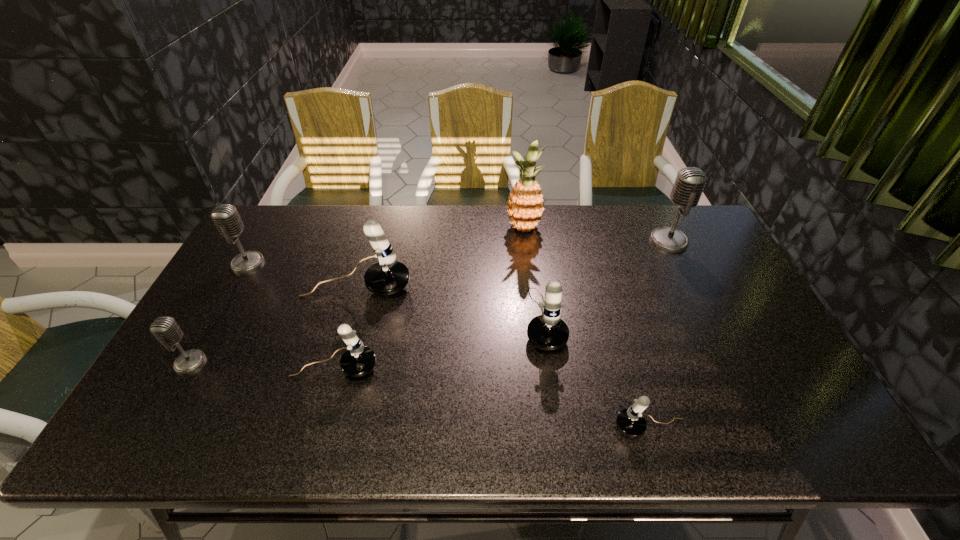
In order to click on the tallest object in this screenshot , I will do `click(525, 207)`.

The width and height of the screenshot is (960, 540). Find the location of `the rightmost microphone`. the rightmost microphone is located at coordinates pos(690,182).

Find the location of a particular element. the farthest microphone is located at coordinates (690, 182).

At what (x,y) coordinates should I click in order to perform the action: click on the biggest white microphone. Please return your answer as a coordinate pair (x, y). The height and width of the screenshot is (540, 960). Looking at the image, I should click on (386, 277).

Identify the location of the second nearest gray microphone. coord(225,216).

Find the location of a particular element. The image size is (960, 540). the fifth microphone from left to right is located at coordinates (547, 331).

Locate an element on the screen. the second white microphone from right to left is located at coordinates (547, 331).

Find the location of a particular element. the third biggest white microphone is located at coordinates (358, 360).

You are a GUI agent. You are given a task and a screenshot of the screen. Output one action in this format:
    pyautogui.click(x=<x>, y=<y>)
    Task: Click on the smallest gray microphone
    
    Given the screenshot: What is the action you would take?
    pyautogui.click(x=165, y=329)

Where is `the smallest white microphone`? Image resolution: width=960 pixels, height=540 pixels. the smallest white microphone is located at coordinates (630, 422).